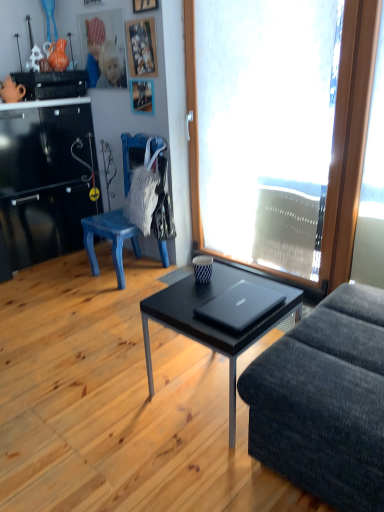
Question: From the image's perspective, relative to wooden picture frame at upper center, marked as the 3th picture frame in a top-to-bottom arrangement, is transparent glass window at center above or below?

Choices:
 (A) above
 (B) below

Answer: (B)

Question: Is transparent glass window at center bigger or smaller than wooden picture frame at upper center, marked as the 3th picture frame in a top-to-bottom arrangement?

Choices:
 (A) small
 (B) big

Answer: (B)

Question: Estimate the real-world distances between objects in this image. Which object is closer to the wooden picture frame at upper center, marked as the 3th picture frame in a top-to-bottom arrangement?

Choices:
 (A) black plastic stereo at upper left
 (B) wooden picture frame at upper center, which ranks as the 2th picture frame in bottom-to-top order
 (C) black matte laptop at center
 (D) wooden picture frame at upper center, the 3th picture frame positioned from the bottom
 (E) blue and white ceramic cup at center

Answer: (B)

Question: Which object is positioned closest to the blue painted wood chair at left?

Choices:
 (A) blue and white ceramic cup at center
 (B) black matte coffee table at center
 (C) transparent glass window at center
 (D) wooden picture frame at upper center, the second picture frame in the top-to-bottom sequence
 (E) wooden picture frame at upper center, acting as the first picture frame starting from the bottom

Answer: (E)